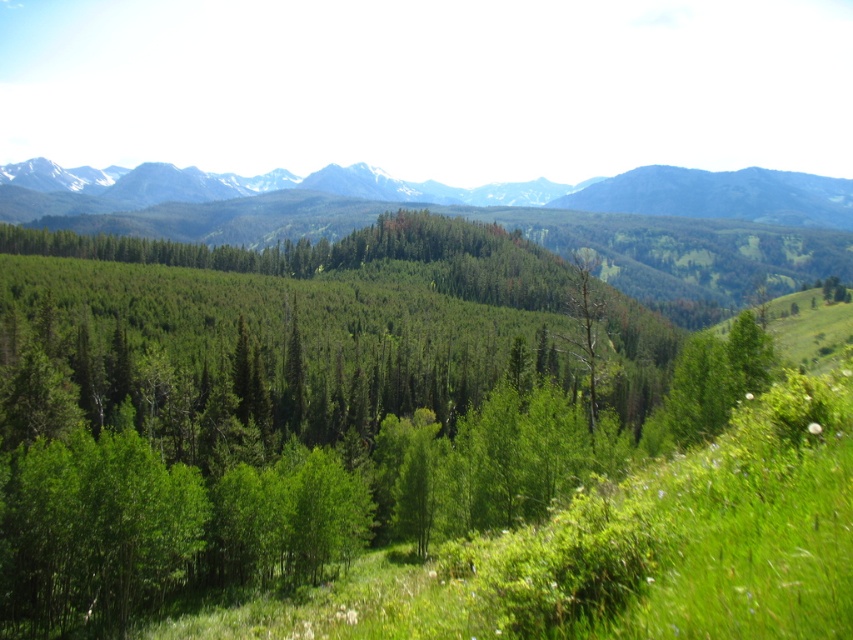
From the picture: You are an environmental researcher analyzing the landscape. You notice the snowy rocky mountain range at upper center and the dead wood tree at center. Which object would have a more significant impact on the local ecosystem if it were to disappear?

The snowy rocky mountain range at upper center would have a more significant impact on the local ecosystem if it were to disappear because it is larger in size than the dead wood tree at center, meaning it likely plays a more substantial role in water retention, habitat provision, and climate regulation.